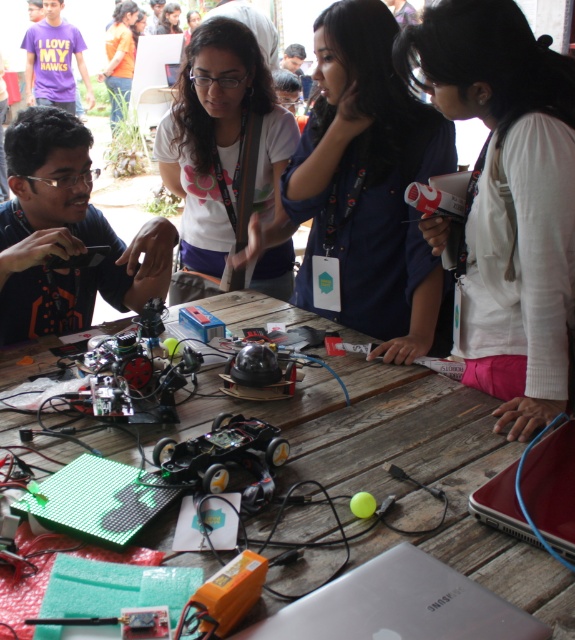
What do you see at coordinates (400, 461) in the screenshot? This screenshot has width=575, height=640. I see `wooden table at center` at bounding box center [400, 461].

Is wooden table at center further to camera compared to purple cotton shirt at upper left?

No, it is not.

Identify the location of wooden table at center. This screenshot has height=640, width=575. (400, 461).

Identify the location of wooden table at center. (400, 461).

Which of these two, matte white shirt at center or red matte laptop at lower right, stands shorter?

red matte laptop at lower right is shorter.

How distant is matte white shirt at center from red matte laptop at lower right?

matte white shirt at center is 1.25 meters away from red matte laptop at lower right.

I want to click on matte white shirt at center, so click(228, 154).

I want to click on matte white shirt at center, so click(228, 154).

Describe the element at coordinates (66, 234) in the screenshot. I see `matte black shirt at left` at that location.

Is matte black shirt at left above silver metallic laptop at center?

Correct, matte black shirt at left is located above silver metallic laptop at center.

At what (x,y) coordinates should I click in order to perform the action: click on matte black shirt at left. Please return your answer as a coordinate pair (x, y). Looking at the image, I should click on (66, 234).